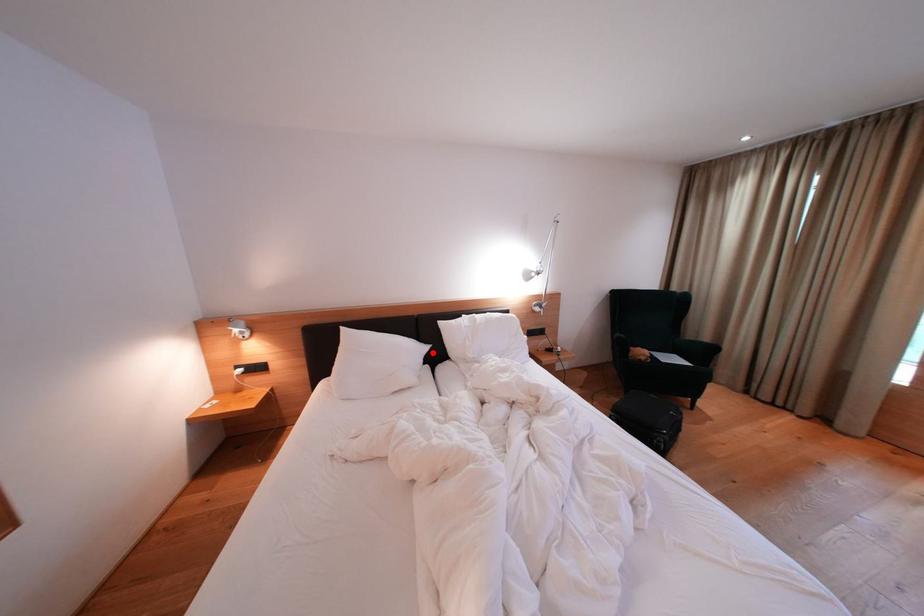
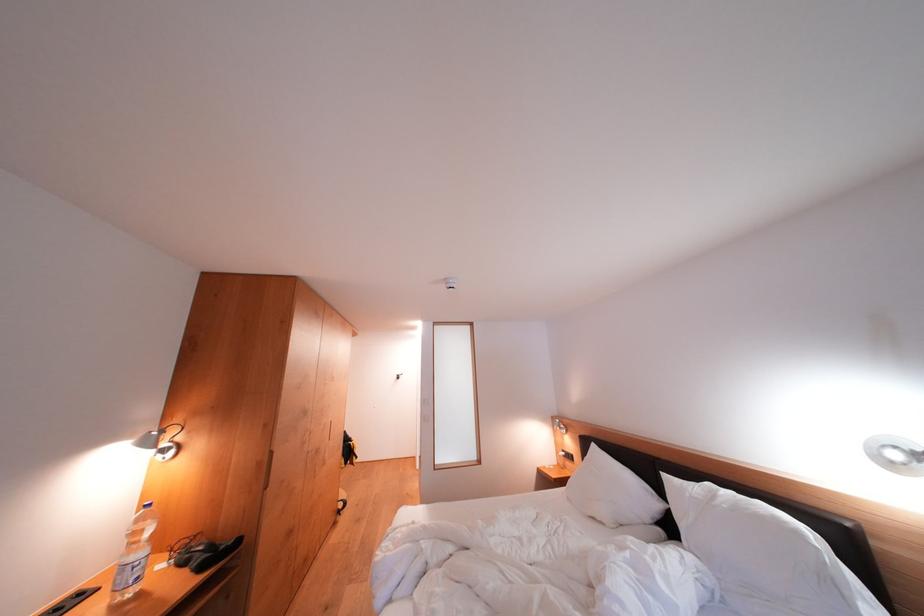
Where in the second image is the point corresponding to the highlighted location from the first image?

(664, 509)